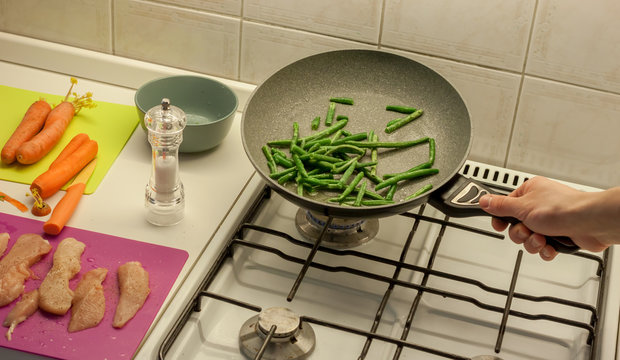
Identify the location of salt shaker. The width and height of the screenshot is (620, 360). (162, 166).